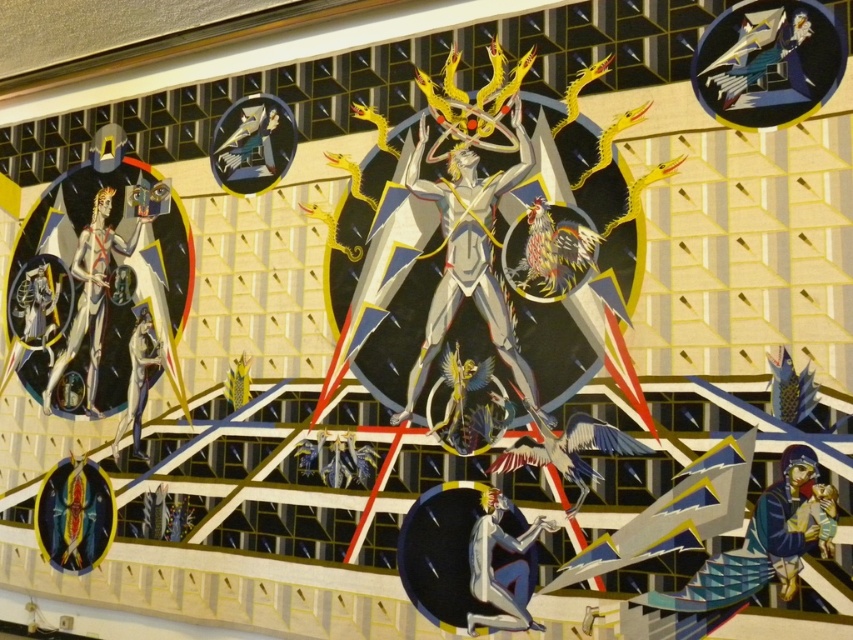
You are an artist analyzing this surreal artwork. You notice the metallic silver figure at center and the gold textured fabric at lower right. Based on their positions, which one appears closer to the viewer?

The metallic silver figure at center appears closer to the viewer because the gold textured fabric at lower right is positioned behind it.

You are an observer standing in front of the artwork. You see the metallic silver figure at center and the smooth silver figure at lower left. Which one appears closer to you?

The metallic silver figure at center is in front of the smooth silver figure at lower left, so it appears closer to you.

Based on the coordinates provided in the description, where is the metallic silver figure at center located in the image?

The metallic silver figure at center is located at point (468, 253).